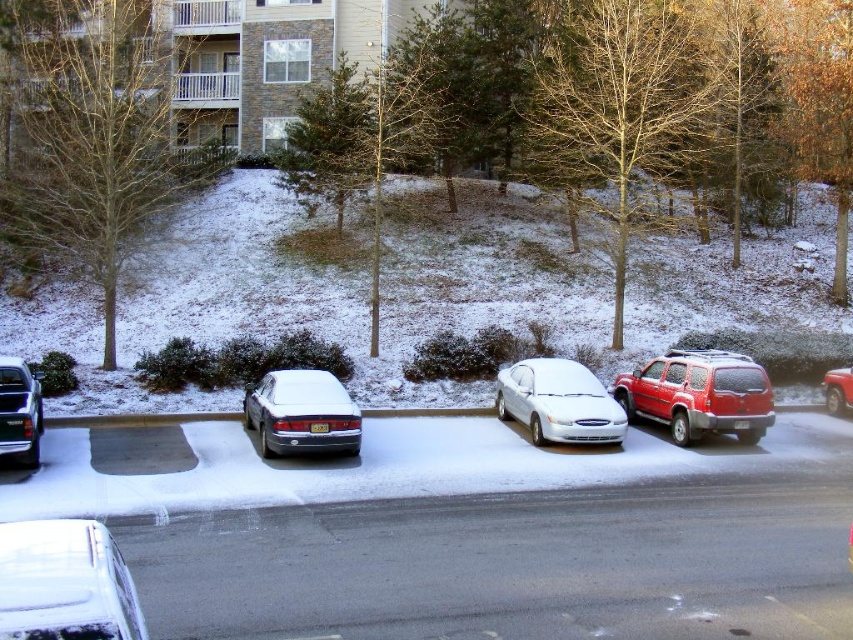
Is point (560, 435) closer to viewer compared to point (846, 385)?

Yes, it is.

What do you see at coordinates (560, 403) in the screenshot?
I see `white glossy sedan at center` at bounding box center [560, 403].

The width and height of the screenshot is (853, 640). Identify the location of white glossy sedan at center. 560,403.

The height and width of the screenshot is (640, 853). In order to click on white glossy sedan at center in this screenshot , I will do click(560, 403).

Is white glossy sedan at lower left shorter than white glossy sedan at center?

Indeed, white glossy sedan at lower left has a lesser height compared to white glossy sedan at center.

Who is positioned more to the left, white glossy sedan at lower left or white glossy sedan at center?

Positioned to the left is white glossy sedan at lower left.

In the scene shown: Who is more distant from viewer, (83, 612) or (535, 392)?

Point (535, 392)

I want to click on white glossy sedan at lower left, so click(x=65, y=582).

Between sleek silver sedan at center and shiny red suv at right, which one is positioned higher?

sleek silver sedan at center

Who is more forward, (282, 422) or (827, 397)?

Point (282, 422)

The image size is (853, 640). Describe the element at coordinates (300, 413) in the screenshot. I see `sleek silver sedan at center` at that location.

Image resolution: width=853 pixels, height=640 pixels. I want to click on sleek silver sedan at center, so click(x=300, y=413).